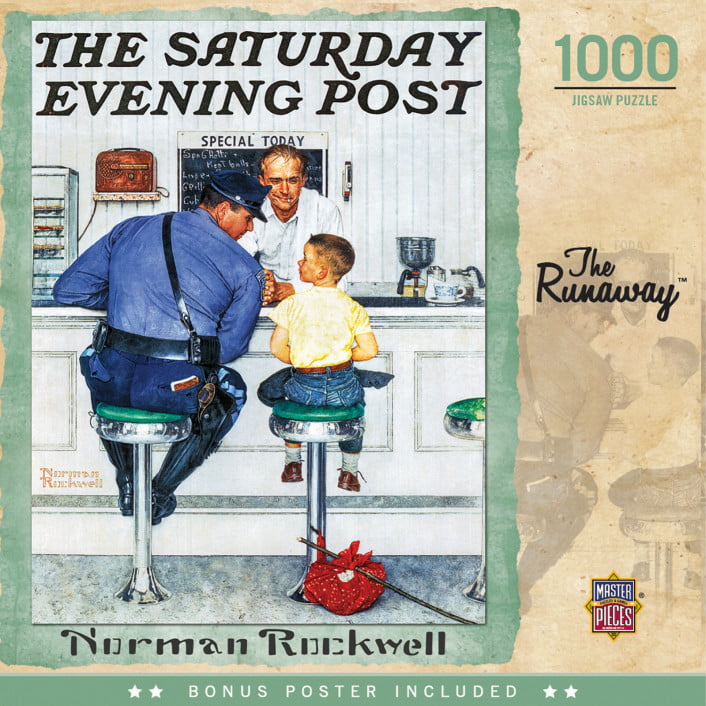
Locate an element on the screen. puzzle box cover is located at coordinates (354, 23), (471, 244).